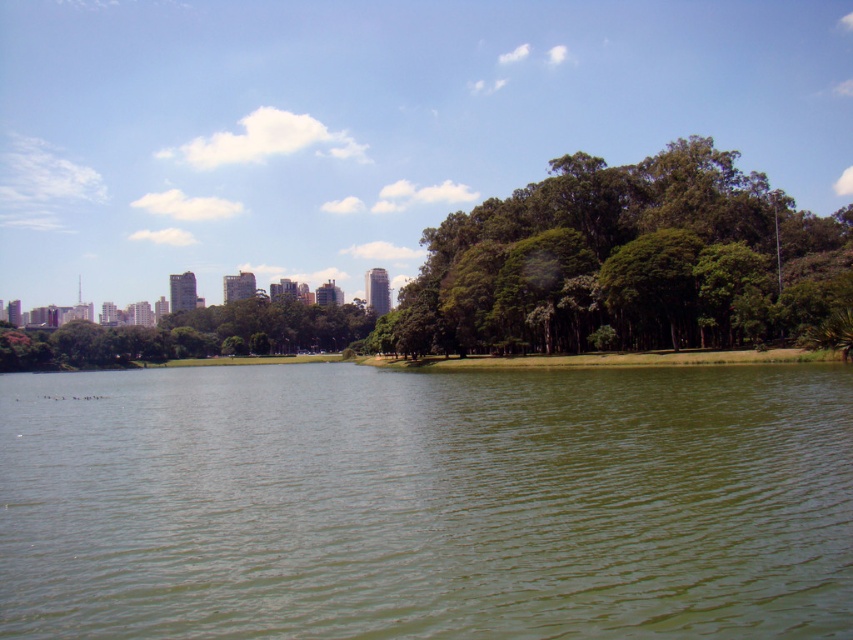
You are a photographer planning to capture the entire scene in one shot. Given that your camera can only focus on objects within a 10m width, will the green water at center and the green leafy trees at center both fit within the frame?

The green water at center is wider than the green leafy trees at center. Since the camera can focus on objects within a 10m width, both objects will fit as their combined width is less than 10m.

You are standing at the lakeside and want to take a photo of both the green water at center and the green leafy tree at center. Which object should you focus on first if you want both to be in sharp focus?

You should focus on the green leafy tree at center first because it is farther away from the viewer than the green water at center. By focusing on the farther object, the closer object will also be in focus due to the depth of field.